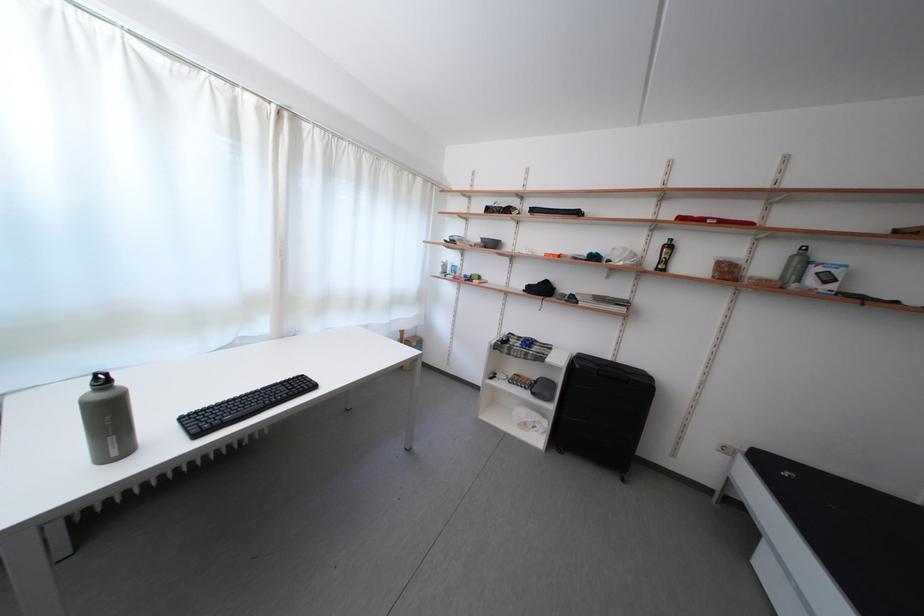
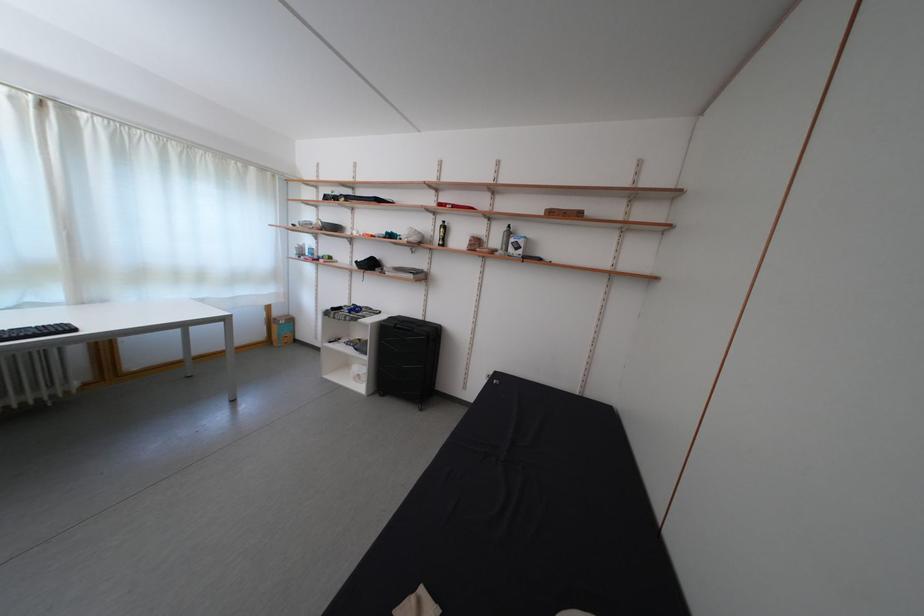
Locate, in the second image, the point that corresponds to (416,341) in the first image.

(285, 320)